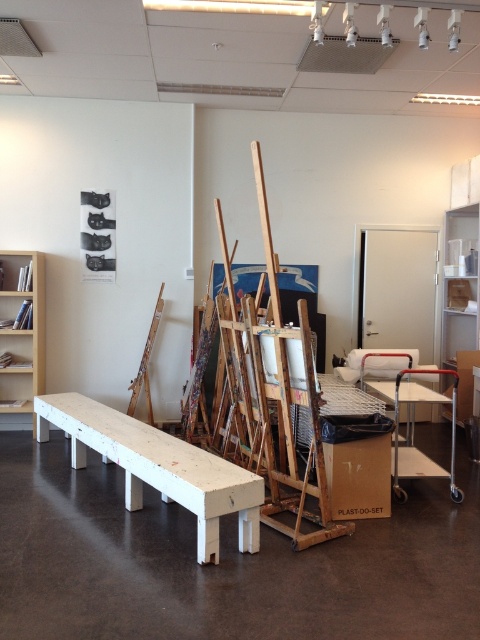
Question: Is wooden easels at center further to the viewer compared to light brown wooden bookshelf at left?

Choices:
 (A) no
 (B) yes

Answer: (A)

Question: Is wooden easels at center bigger than cardboard box at center?

Choices:
 (A) no
 (B) yes

Answer: (B)

Question: Which point appears closest to the camera in this image?

Choices:
 (A) (197, 532)
 (B) (260, 416)
 (C) (376, 509)
 (D) (458, 410)

Answer: (A)

Question: Which of the following is the closest to the observer?

Choices:
 (A) (294, 499)
 (B) (203, 499)

Answer: (B)

Question: Considering the relative positions of white wood bench at center and light brown wooden bookshelf at left in the image provided, where is white wood bench at center located with respect to light brown wooden bookshelf at left?

Choices:
 (A) above
 (B) below

Answer: (B)

Question: Which object appears farthest from the camera in this image?

Choices:
 (A) cardboard box at center
 (B) white plastic bookshelf at right

Answer: (B)